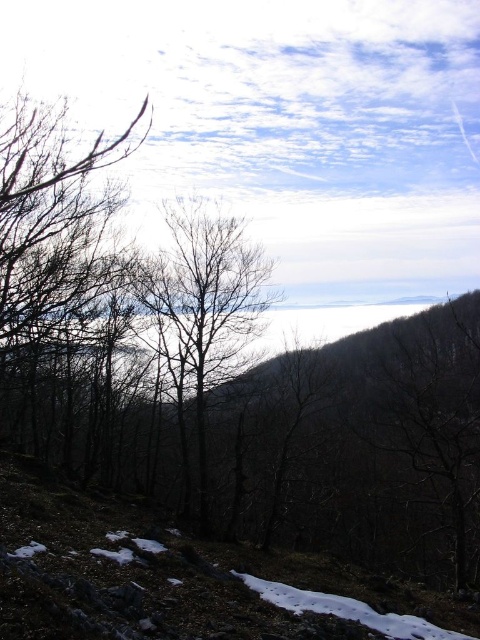
You are standing at the base of the forested hillside and want to reach the point marked as point (x=180, y=344). There is an obstacle at point (x=29, y=284). Will you encounter the obstacle before reaching your destination?

Yes, you will encounter the obstacle at point (x=29, y=284) before reaching point (x=180, y=344) because point (x=29, y=284) is closer to the viewer than point (x=180, y=344).